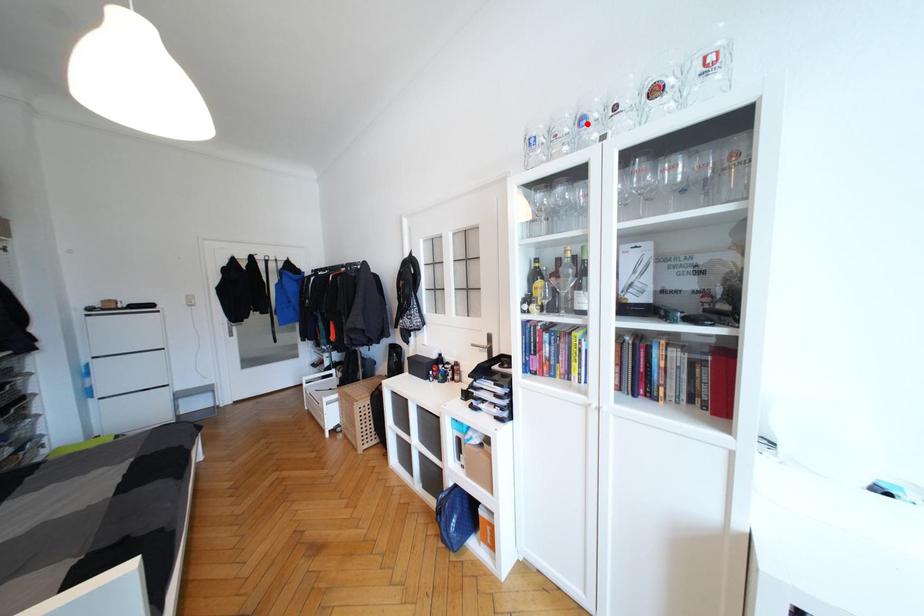
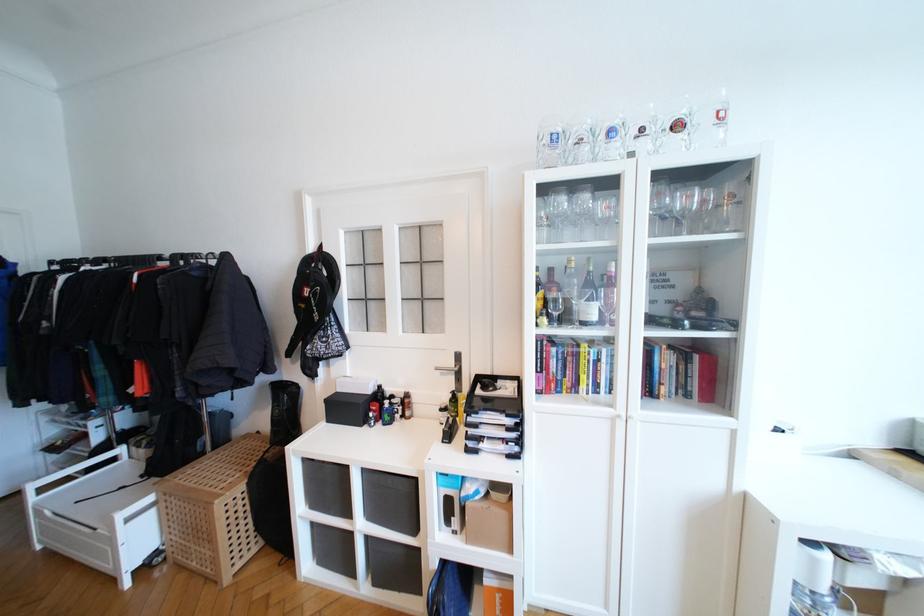
Find the pixel in the second image that matches the highlighted location in the first image.

(616, 136)